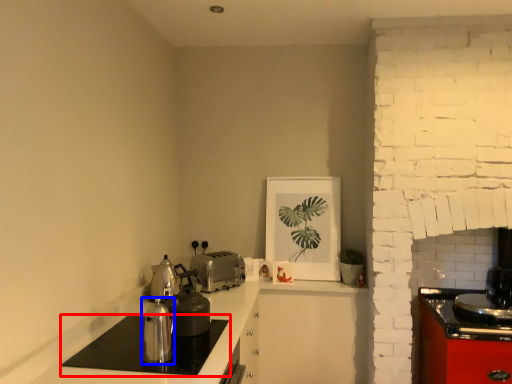
Question: Which point is closer to the camera, home appliance (highlighted by a red box) or kitchen appliance (highlighted by a blue box)?

Choices:
 (A) home appliance
 (B) kitchen appliance

Answer: (A)